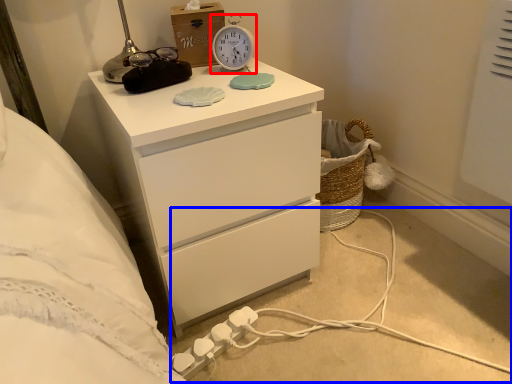
Question: Among these objects, which one is nearest to the camera, alarm clock (highlighted by a red box) or cable (highlighted by a blue box)?

Choices:
 (A) alarm clock
 (B) cable

Answer: (B)